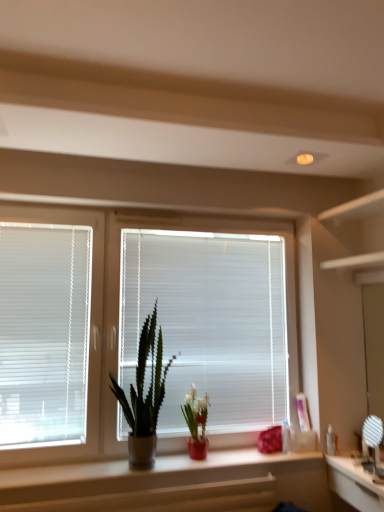
How much space does clear plastic bottle at right, arranged as the second toiletry when viewed from the left, occupy horizontally?

clear plastic bottle at right, arranged as the second toiletry when viewed from the left, is 5.21 centimeters wide.

What is the approximate width of matte plastic bottle at center, arranged as the second toiletry when viewed from the right?

The width of matte plastic bottle at center, arranged as the second toiletry when viewed from the right, is 2.72 inches.

What do you see at coordinates (356, 483) in the screenshot?
I see `white glossy mirror at lower right` at bounding box center [356, 483].

I want to click on matte red vase at center, which is counted as the second houseplant, starting from the left, so pyautogui.click(x=196, y=423).

At what (x,y) coordinates should I click in order to perform the action: click on green matte cactus at center, the first houseplant viewed from the left. Please return your answer as a coordinate pair (x, y). This screenshot has height=512, width=384. Looking at the image, I should click on (145, 396).

This screenshot has width=384, height=512. I want to click on clear plastic bottle at right, the first toiletry positioned from the right, so click(x=331, y=441).

From the image's perspective, is white plastic blinds at center, marked as the second window blind in a left-to-right arrangement, beneath green matte cactus at center, the first houseplant viewed from the left?

Actually, white plastic blinds at center, marked as the second window blind in a left-to-right arrangement, appears above green matte cactus at center, the first houseplant viewed from the left, in the image.

From a real-world perspective, is white plastic blinds at center, arranged as the 1th window blind when viewed from the right, positioned above or below green matte cactus at center, the first houseplant viewed from the left?

From a real-world perspective, white plastic blinds at center, arranged as the 1th window blind when viewed from the right, is physically above green matte cactus at center, the first houseplant viewed from the left.

Can you confirm if white plastic blinds at center, arranged as the 1th window blind when viewed from the right, is positioned to the left of green matte cactus at center, the first houseplant viewed from the left?

No.

The height and width of the screenshot is (512, 384). In order to click on the 1st houseplant to the left when counting from the white glossy mirror at lower right in this screenshot , I will do `click(196, 423)`.

In the image, is matte red vase at center, which is counted as the second houseplant, starting from the left, on the left side or the right side of white glossy mirror at lower right?

matte red vase at center, which is counted as the second houseplant, starting from the left, is to the left of white glossy mirror at lower right.

Is matte red vase at center, which is counted as the second houseplant, starting from the left, with white glossy mirror at lower right?

No, matte red vase at center, which is counted as the second houseplant, starting from the left, is not touching white glossy mirror at lower right.

Considering the positions of objects matte red vase at center, which is counted as the first houseplant, starting from the right, and white glossy mirror at lower right in the image provided, who is behind, matte red vase at center, which is counted as the first houseplant, starting from the right, or white glossy mirror at lower right?

Positioned behind is matte red vase at center, which is counted as the first houseplant, starting from the right.

Is green matte cactus at center, the first houseplant viewed from the left, outside of white plastic blinds at center, marked as the second window blind in a left-to-right arrangement?

Yes, green matte cactus at center, the first houseplant viewed from the left, is located beyond the bounds of white plastic blinds at center, marked as the second window blind in a left-to-right arrangement.

In the scene shown: Is white plastic blinds at center, marked as the second window blind in a left-to-right arrangement, at the back of green matte cactus at center, the 2th houseplant when ordered from right to left?

Absolutely, green matte cactus at center, the 2th houseplant when ordered from right to left, is directed away from white plastic blinds at center, marked as the second window blind in a left-to-right arrangement.

Are green matte cactus at center, the 2th houseplant when ordered from right to left, and white plastic blinds at center, arranged as the 1th window blind when viewed from the right, far apart?

They are positioned close to each other.

From the image's perspective, between white plastic blinds at center, arranged as the 1th window blind when viewed from the right, and white glossy mirror at lower right, who is located below?

white glossy mirror at lower right is shown below in the image.

Is white plastic blinds at center, arranged as the 1th window blind when viewed from the right, oriented towards white glossy mirror at lower right?

No, white plastic blinds at center, arranged as the 1th window blind when viewed from the right, is not turned towards white glossy mirror at lower right.

From a real-world perspective, who is located lower, white plastic blinds at center, marked as the second window blind in a left-to-right arrangement, or white glossy mirror at lower right?

white glossy mirror at lower right is physically lower.

Is smooth white counter at lower center further to camera compared to white plastic blinds at left, which is counted as the 1th window blind, starting from the left?

No, smooth white counter at lower center is closer to the viewer.

Can you confirm if smooth white counter at lower center is smaller than white plastic blinds at left, which is counted as the 1th window blind, starting from the left?

Yes.

Is white plastic blinds at left, the second window blind when ordered from right to left, a part of smooth white counter at lower center?

A: No, white plastic blinds at left, the second window blind when ordered from right to left, is located outside of smooth white counter at lower center.

Measure the distance from smooth white counter at lower center to white plastic blinds at left, which is counted as the 1th window blind, starting from the left.

27.78 inches.

Which of these two, smooth white counter at lower center or white plastic window at center, stands taller?

white plastic window at center.

Considering the sizes of smooth white counter at lower center and white plastic window at center in the image, is smooth white counter at lower center wider or thinner than white plastic window at center?

In the image, smooth white counter at lower center appears to be wider than white plastic window at center.

Which object is positioned more to the left, smooth white counter at lower center or white plastic window at center?

From the viewer's perspective, white plastic window at center appears more on the left side.

Does smooth white counter at lower center lie behind white plastic window at center?

That is False.

Does point (344, 498) appear closer or farther from the camera than point (159, 404)?

Point (344, 498) is closer to the camera than point (159, 404).

How many degrees apart are the facing directions of white glossy mirror at lower right and green matte cactus at center, the 2th houseplant when ordered from right to left?

The facing directions of white glossy mirror at lower right and green matte cactus at center, the 2th houseplant when ordered from right to left, are 89.5 degrees apart.

Is white glossy mirror at lower right in front of green matte cactus at center, the 2th houseplant when ordered from right to left?

Yes, it is.

From the image's perspective, would you say white glossy mirror at lower right is positioned over green matte cactus at center, the first houseplant viewed from the left?

No, from the image's perspective, white glossy mirror at lower right is not above green matte cactus at center, the first houseplant viewed from the left.

The image size is (384, 512). Find the location of `the 1st houseplant positioned below the white plastic blinds at center, marked as the second window blind in a left-to-right arrangement (from the image's perspective)`. the 1st houseplant positioned below the white plastic blinds at center, marked as the second window blind in a left-to-right arrangement (from the image's perspective) is located at coordinates (145, 396).

From the white glossy mirror at lower right, count the 1st houseplant to the left and point to it. Please provide its 2D coordinates.

[(196, 423)]

From the image, which object appears to be farther from smooth white counter at lower center, white plastic blinds at left, the second window blind when ordered from right to left, or clear plastic bottle at right, the first toiletry positioned from the right?

clear plastic bottle at right, the first toiletry positioned from the right, is positioned further to the anchor smooth white counter at lower center.

Estimate the real-world distances between objects in this image. Which object is closer to white plastic blinds at center, marked as the second window blind in a left-to-right arrangement, green matte cactus at center, the first houseplant viewed from the left, or smooth white counter at lower center?

green matte cactus at center, the first houseplant viewed from the left, is positioned closer to the anchor white plastic blinds at center, marked as the second window blind in a left-to-right arrangement.

Based on their spatial positions, is green matte cactus at center, the first houseplant viewed from the left, or clear plastic bottle at right, the first toiletry positioned from the right, further from white glossy mirror at lower right?

green matte cactus at center, the first houseplant viewed from the left.

Looking at the image, which one is located further to clear plastic bottle at right, arranged as the second toiletry when viewed from the left, white plastic window at center or matte plastic bottle at center, which ranks as the 1th toiletry in left-to-right order?

Based on the image, white plastic window at center appears to be further to clear plastic bottle at right, arranged as the second toiletry when viewed from the left.

Looking at this image, looking at the image, which one is located closer to smooth white counter at lower center, clear plastic bottle at right, arranged as the second toiletry when viewed from the left, or white plastic window at center?

The object closer to smooth white counter at lower center is white plastic window at center.

From the picture: Estimate the real-world distances between objects in this image. Which object is closer to white plastic blinds at left, the second window blind when ordered from right to left, matte plastic bottle at center, which ranks as the 1th toiletry in left-to-right order, or white glossy mirror at lower right?

Based on the image, matte plastic bottle at center, which ranks as the 1th toiletry in left-to-right order, appears to be nearer to white plastic blinds at left, the second window blind when ordered from right to left.

From the picture: Which object lies further to the anchor point matte red vase at center, which is counted as the second houseplant, starting from the left, green matte cactus at center, the 2th houseplant when ordered from right to left, or matte plastic bottle at center, arranged as the second toiletry when viewed from the right?

Among the two, matte plastic bottle at center, arranged as the second toiletry when viewed from the right, is located further to matte red vase at center, which is counted as the second houseplant, starting from the left.

From the image, which object appears to be farther from white glossy mirror at lower right, matte plastic bottle at center, which ranks as the 1th toiletry in left-to-right order, or white plastic blinds at center, arranged as the 1th window blind when viewed from the right?

white plastic blinds at center, arranged as the 1th window blind when viewed from the right, lies further to white glossy mirror at lower right than the other object.

Find the location of a particular element. The height and width of the screenshot is (512, 384). window blind between white plastic window at center and clear plastic bottle at right, the first toiletry positioned from the right, in the horizontal direction is located at coordinates (209, 323).

The width and height of the screenshot is (384, 512). I want to click on window blind located between smooth white counter at lower center and clear plastic bottle at right, arranged as the second toiletry when viewed from the left, in the left-right direction, so click(209, 323).

The width and height of the screenshot is (384, 512). Identify the location of window between green matte cactus at center, the 2th houseplant when ordered from right to left, and clear plastic bottle at right, arranged as the second toiletry when viewed from the left. (118, 312).

The image size is (384, 512). I want to click on counter situated between white plastic blinds at left, the second window blind when ordered from right to left, and white glossy mirror at lower right from left to right, so point(172,484).